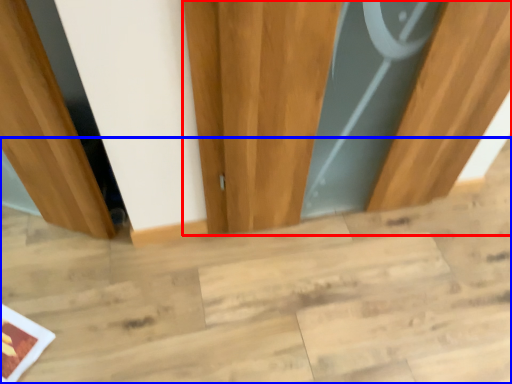
Question: Which point is closer to the camera, door (highlighted by a red box) or stair (highlighted by a blue box)?

Choices:
 (A) door
 (B) stair

Answer: (A)